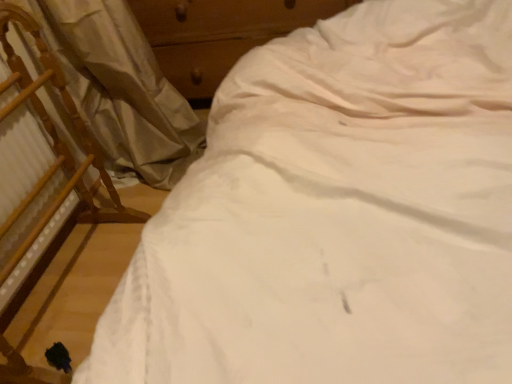
This screenshot has width=512, height=384. I want to click on wooden chair at left, so click(x=41, y=154).

Identify the location of wooden chair at left. (41, 154).

From the image's perspective, is white fabric curtain at left below wooden dresser at upper center?

Yes, from the image's perspective, white fabric curtain at left is beneath wooden dresser at upper center.

Is white fabric curtain at left bigger than wooden dresser at upper center?

No.

Considering the relative sizes of white fabric curtain at left and wooden dresser at upper center in the image provided, is white fabric curtain at left thinner than wooden dresser at upper center?

Correct, the width of white fabric curtain at left is less than that of wooden dresser at upper center.

From a real-world perspective, which object rests below the other?

In real-world perspective, wooden dresser at upper center is lower.

From the image's perspective, is wooden dresser at upper center over wooden chair at left?

Yes, from the image's perspective, wooden dresser at upper center is on top of wooden chair at left.

Is wooden dresser at upper center at the right side of wooden chair at left?

Yes.

Does wooden dresser at upper center touch wooden chair at left?

wooden dresser at upper center is not next to wooden chair at left, and they're not touching.

From the image's perspective, is wooden chair at left located above or below white fabric curtain at left?

Based on their image positions, wooden chair at left is located beneath white fabric curtain at left.

In the scene shown: Is wooden chair at left facing towards white fabric curtain at left?

No, wooden chair at left is not turned towards white fabric curtain at left.

Which object is closer to the camera taking this photo, wooden chair at left or white fabric curtain at left?

Positioned in front is wooden chair at left.

Between wooden dresser at upper center and white fabric curtain at left, which one has larger size?

wooden dresser at upper center.

In the scene shown: From the image's perspective, which one is positioned higher, wooden dresser at upper center or white fabric curtain at left?

wooden dresser at upper center.

Would you say white fabric curtain at left is part of wooden dresser at upper center's contents?

No, white fabric curtain at left is located outside of wooden dresser at upper center.

Based on the photo, which of these two, wooden chair at left or wooden dresser at upper center, stands shorter?

With less height is wooden dresser at upper center.

Could you tell me if wooden chair at left is turned towards wooden dresser at upper center?

No, wooden chair at left is not facing towards wooden dresser at upper center.

At what (x,y) coordinates should I click in order to perform the action: click on dresser on the right of wooden chair at left. Please return your answer as a coordinate pair (x, y). The image size is (512, 384). Looking at the image, I should click on (219, 34).

Are wooden chair at left and wooden dresser at upper center beside each other?

No, wooden chair at left is not touching wooden dresser at upper center.

Based on the photo, is white fabric curtain at left thinner than wooden chair at left?

Incorrect, the width of white fabric curtain at left is not less than that of wooden chair at left.

Is point (187, 131) closer or farther from the camera than point (61, 146)?

Point (187, 131) is farther from the camera than point (61, 146).

Is white fabric curtain at left turned away from wooden chair at left?

white fabric curtain at left is not turned away from wooden chair at left.

Considering the sizes of objects white fabric curtain at left and wooden chair at left in the image provided, who is bigger, white fabric curtain at left or wooden chair at left?

With larger size is white fabric curtain at left.

This screenshot has height=384, width=512. What are the coordinates of `curtain on the left of wooden dresser at upper center` in the screenshot? It's located at (121, 88).

Where is `chair in front of the wooden dresser at upper center`? This screenshot has width=512, height=384. chair in front of the wooden dresser at upper center is located at coordinates (41, 154).

Which object lies nearer to the anchor point wooden dresser at upper center, wooden chair at left or white fabric curtain at left?

white fabric curtain at left is positioned closer to the anchor wooden dresser at upper center.

Estimate the real-world distances between objects in this image. Which object is closer to wooden dresser at upper center, white fabric curtain at left or wooden chair at left?

white fabric curtain at left.

Looking at the image, which one is located closer to wooden chair at left, white fabric curtain at left or wooden dresser at upper center?

white fabric curtain at left is closer to wooden chair at left.

Looking at the image, which one is located further to wooden chair at left, wooden dresser at upper center or white fabric curtain at left?

Based on the image, wooden dresser at upper center appears to be further to wooden chair at left.

Estimate the real-world distances between objects in this image. Which object is further from white fabric curtain at left, wooden dresser at upper center or wooden chair at left?

Based on the image, wooden dresser at upper center appears to be further to white fabric curtain at left.

Considering their positions, is wooden chair at left positioned closer to white fabric curtain at left than wooden dresser at upper center?

wooden chair at left is closer to white fabric curtain at left.

The width and height of the screenshot is (512, 384). Find the location of `curtain between wooden chair at left and wooden dresser at upper center from front to back`. curtain between wooden chair at left and wooden dresser at upper center from front to back is located at coordinates (121, 88).